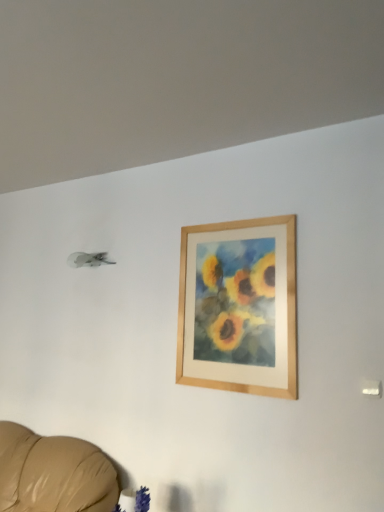
Question: Is velvety blue plant at lower center outside wooden frame at upper center?

Choices:
 (A) no
 (B) yes

Answer: (B)

Question: Does velvety blue plant at lower center have a lesser height compared to wooden frame at upper center?

Choices:
 (A) no
 (B) yes

Answer: (B)

Question: Considering the relative sizes of velvety blue plant at lower center and wooden frame at upper center in the image provided, is velvety blue plant at lower center taller than wooden frame at upper center?

Choices:
 (A) no
 (B) yes

Answer: (A)

Question: From a real-world perspective, is velvety blue plant at lower center located beneath wooden frame at upper center?

Choices:
 (A) no
 (B) yes

Answer: (B)

Question: Is velvety blue plant at lower center positioned with its back to wooden frame at upper center?

Choices:
 (A) no
 (B) yes

Answer: (A)

Question: Is the position of velvety blue plant at lower center more distant than that of wooden frame at upper center?

Choices:
 (A) yes
 (B) no

Answer: (B)

Question: From a real-world perspective, is wooden frame at upper center physically above velvety blue plant at lower center?

Choices:
 (A) no
 (B) yes

Answer: (B)

Question: Is wooden frame at upper center directly adjacent to velvety blue plant at lower center?

Choices:
 (A) no
 (B) yes

Answer: (A)

Question: Considering the relative sizes of wooden frame at upper center and velvety blue plant at lower center in the image provided, is wooden frame at upper center shorter than velvety blue plant at lower center?

Choices:
 (A) no
 (B) yes

Answer: (A)

Question: Is wooden frame at upper center positioned with its back to velvety blue plant at lower center?

Choices:
 (A) yes
 (B) no

Answer: (B)

Question: Is wooden frame at upper center wider than velvety blue plant at lower center?

Choices:
 (A) yes
 (B) no

Answer: (B)

Question: From a real-world perspective, is wooden frame at upper center located beneath velvety blue plant at lower center?

Choices:
 (A) no
 (B) yes

Answer: (A)

Question: In the image, is velvety blue plant at lower center positioned in front of or behind wooden frame at upper center?

Choices:
 (A) behind
 (B) front

Answer: (B)